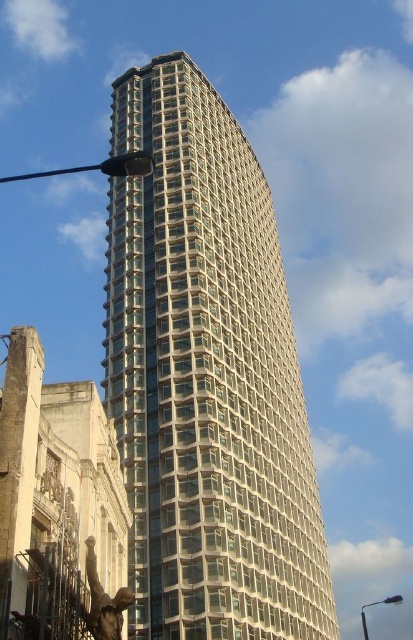
Between clear glass building at center and black metal pole at left, which one is positioned higher?

black metal pole at left is above.

Which is more to the right, clear glass building at center or black metal pole at left?

clear glass building at center

The height and width of the screenshot is (640, 413). Find the location of `clear glass building at center`. clear glass building at center is located at coordinates coord(206,378).